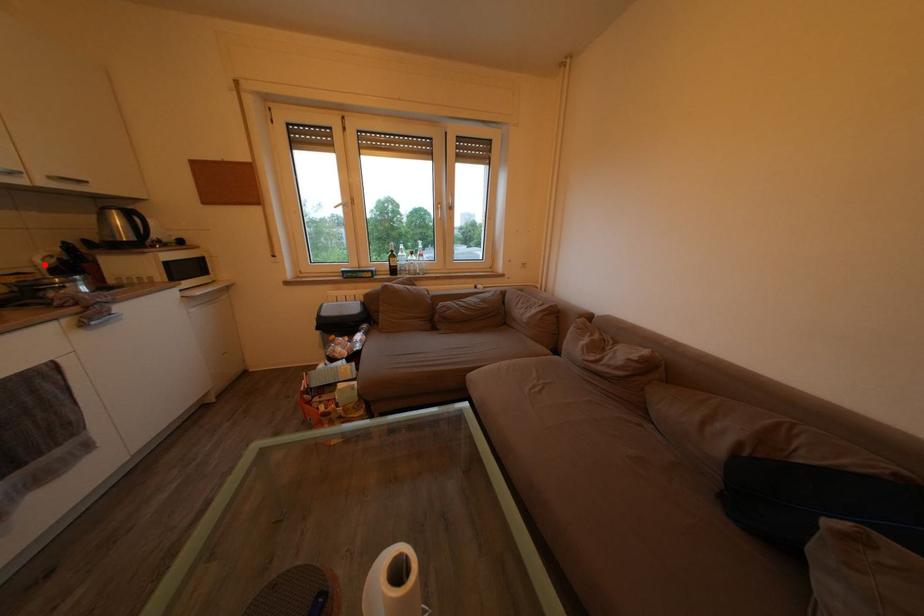
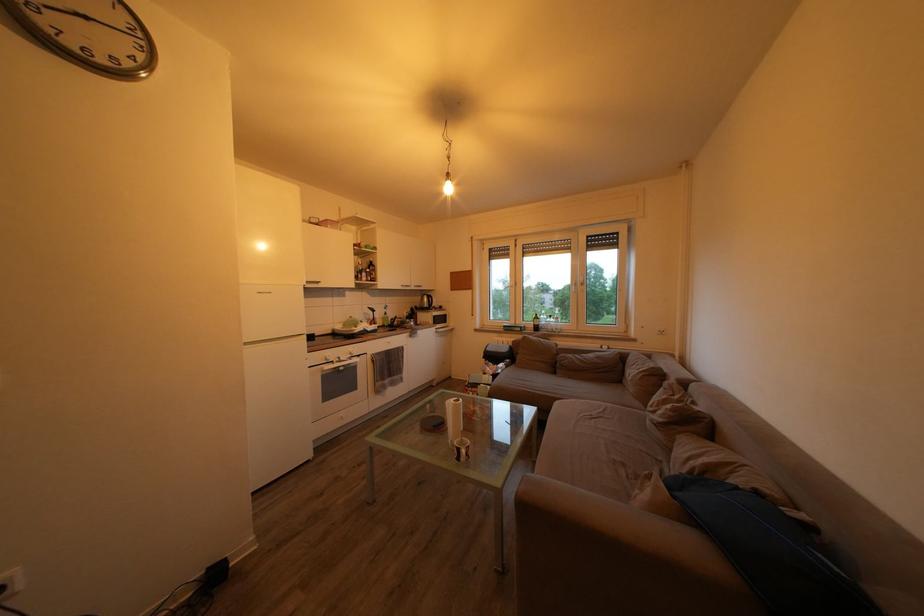
Question: I am providing you with two images of the same scene from different viewpoints. Image1 has a red point marked. In image2, the corresponding 3D location appears at what relative position? Reply with the corresponding letter.

Choices:
 (A) Closer
 (B) Farther

Answer: (A)